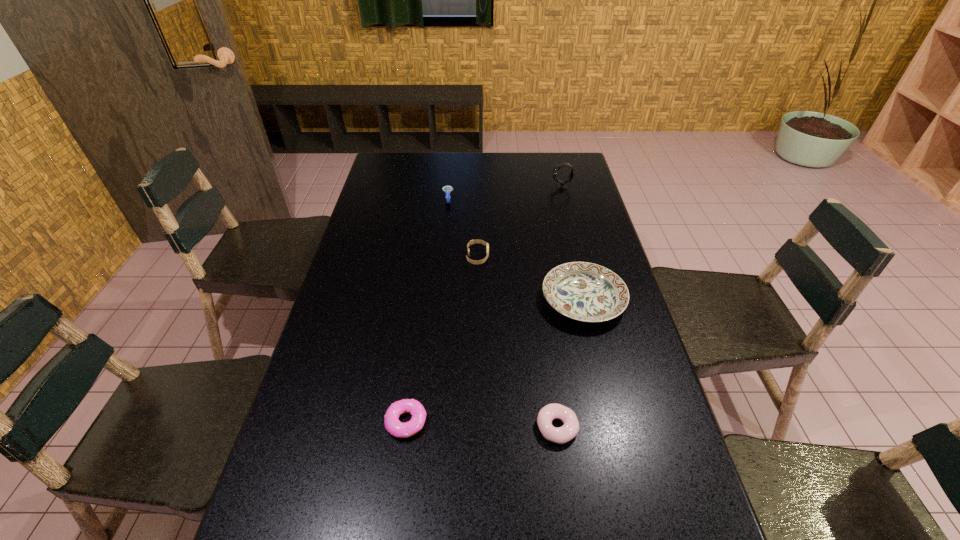
Locate an element on the screen. The height and width of the screenshot is (540, 960). vacant region that satisfies the following two spatial constraints: 1. on the front side of the second farthest watch; 2. on the right side of the third nearest object is located at coordinates (439, 300).

Where is `free space that satisfies the following two spatial constraints: 1. on the face of the rightmost watch; 2. on the front side of the plate`? This screenshot has width=960, height=540. free space that satisfies the following two spatial constraints: 1. on the face of the rightmost watch; 2. on the front side of the plate is located at coordinates (590, 300).

The image size is (960, 540). Find the location of `free spot that satisfies the following two spatial constraints: 1. on the back side of the leftmost watch; 2. on the right side of the left doughnut`. free spot that satisfies the following two spatial constraints: 1. on the back side of the leftmost watch; 2. on the right side of the left doughnut is located at coordinates (436, 200).

I want to click on vacant area that satisfies the following two spatial constraints: 1. on the face of the fourth nearest object; 2. on the back side of the right doughnut, so click(476, 428).